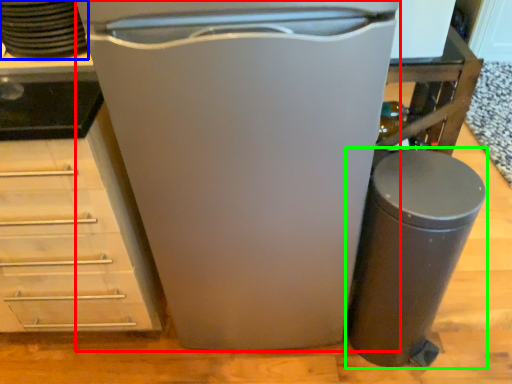
Question: Which object is positioned farthest from home appliance (highlighted by a red box)? Select from appliance (highlighted by a blue box) and waste container (highlighted by a green box).

Choices:
 (A) appliance
 (B) waste container

Answer: (A)